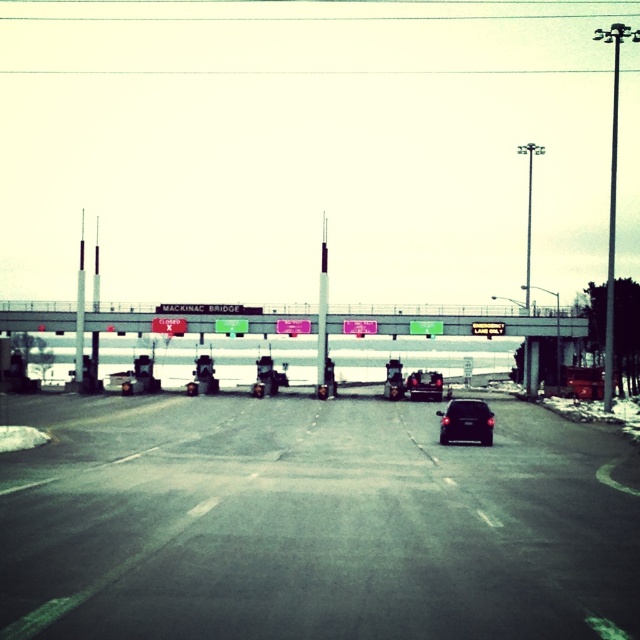
Question: Is metallic pole at center further to camera compared to metallic silver pole at left?

Choices:
 (A) yes
 (B) no

Answer: (B)

Question: Estimate the real-world distances between objects in this image. Which object is closer to the black matte car at center?

Choices:
 (A) metallic gray bridge at center
 (B) metallic pole at right

Answer: (A)

Question: Is black asphalt highway at center bigger than metallic pole at right?

Choices:
 (A) no
 (B) yes

Answer: (A)

Question: Does matte black car at center appear on the right side of metallic pole at left?

Choices:
 (A) no
 (B) yes

Answer: (B)

Question: Among these points, which one is nearest to the camera?

Choices:
 (A) (81, 372)
 (B) (536, 600)

Answer: (B)

Question: Which object appears closest to the camera in this image?

Choices:
 (A) metallic pole at center
 (B) black matte car at center
 (C) metallic gray bridge at center
 (D) metallic silver car at center

Answer: (D)